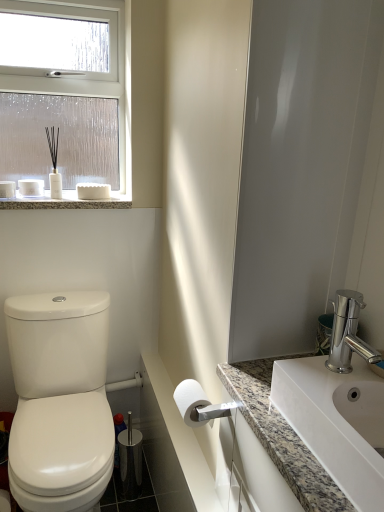
Question: Considering the relative sizes of granite countertop at lower right, the second counter top positioned from the left, and white plastic towel bar at lower center in the image provided, is granite countertop at lower right, the second counter top positioned from the left, smaller than white plastic towel bar at lower center?

Choices:
 (A) yes
 (B) no

Answer: (B)

Question: Considering the relative sizes of granite countertop at lower right, the 1th counter top from the right, and white plastic towel bar at lower center in the image provided, is granite countertop at lower right, the 1th counter top from the right, bigger than white plastic towel bar at lower center?

Choices:
 (A) yes
 (B) no

Answer: (A)

Question: Is granite countertop at lower right, the 1th counter top from the right, to the right of white plastic towel bar at lower center from the viewer's perspective?

Choices:
 (A) no
 (B) yes

Answer: (B)

Question: Is granite countertop at lower right, the second counter top positioned from the left, far away from white plastic towel bar at lower center?

Choices:
 (A) yes
 (B) no

Answer: (A)

Question: Does granite countertop at lower right, the second counter top positioned from the left, have a lesser height compared to white plastic towel bar at lower center?

Choices:
 (A) yes
 (B) no

Answer: (B)

Question: Based on their positions, is white marble countertop at lower center, the 2th counter top in the right-to-left sequence, located to the left or right of granite countertop at upper left?

Choices:
 (A) right
 (B) left

Answer: (A)

Question: Considering the positions of point (180, 448) and point (44, 199), is point (180, 448) closer or farther from the camera than point (44, 199)?

Choices:
 (A) closer
 (B) farther

Answer: (A)

Question: Is white marble countertop at lower center, the 2th counter top in the right-to-left sequence, bigger or smaller than granite countertop at upper left?

Choices:
 (A) small
 (B) big

Answer: (A)

Question: In terms of height, does white marble countertop at lower center, acting as the 1th counter top starting from the left, look taller or shorter compared to granite countertop at upper left?

Choices:
 (A) short
 (B) tall

Answer: (A)

Question: From the image's perspective, is white plastic towel bar at lower center located above or below white marble countertop at lower center, acting as the 1th counter top starting from the left?

Choices:
 (A) above
 (B) below

Answer: (B)

Question: Is white plastic towel bar at lower center taller or shorter than white marble countertop at lower center, acting as the 1th counter top starting from the left?

Choices:
 (A) tall
 (B) short

Answer: (A)

Question: In the image, is white plastic towel bar at lower center on the left side or the right side of white marble countertop at lower center, acting as the 1th counter top starting from the left?

Choices:
 (A) left
 (B) right

Answer: (A)

Question: Is point pyautogui.click(x=110, y=391) positioned closer to the camera than point pyautogui.click(x=158, y=366)?

Choices:
 (A) farther
 (B) closer

Answer: (A)

Question: In the image, is granite countertop at lower right, the second counter top positioned from the left, on the left side or the right side of polished chrome faucet at right?

Choices:
 (A) right
 (B) left

Answer: (B)

Question: Is granite countertop at lower right, the second counter top positioned from the left, situated inside polished chrome faucet at right or outside?

Choices:
 (A) inside
 (B) outside

Answer: (B)